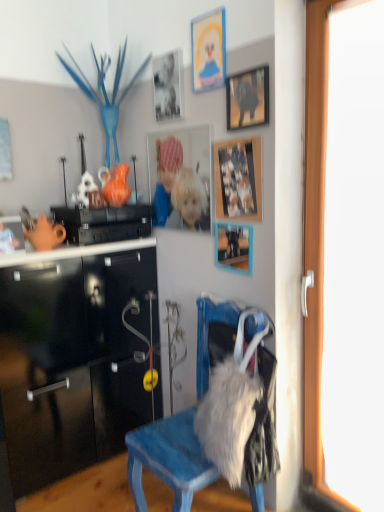
Question: Which direction should I rotate to face matte black picture frame at center, positioned as the 6th picture frame in top-to-bottom order, — up or down?

Choices:
 (A) up
 (B) down

Answer: (A)

Question: Does wooden photo frame at upper center, which is the 5th picture frame in top-to-bottom order, turn towards matte black picture frame at upper center, which is counted as the 4th picture frame, starting from the bottom?

Choices:
 (A) yes
 (B) no

Answer: (B)

Question: Is wooden photo frame at upper center, which is the 5th picture frame in top-to-bottom order, positioned with its back to matte black picture frame at upper center, acting as the third picture frame starting from the top?

Choices:
 (A) no
 (B) yes

Answer: (A)

Question: Considering the relative positions of wooden photo frame at upper center, which is the 5th picture frame in top-to-bottom order, and matte black picture frame at upper center, acting as the third picture frame starting from the top, in the image provided, is wooden photo frame at upper center, which is the 5th picture frame in top-to-bottom order, to the right of matte black picture frame at upper center, acting as the third picture frame starting from the top, from the viewer's perspective?

Choices:
 (A) yes
 (B) no

Answer: (B)

Question: Is wooden photo frame at upper center, the second picture frame when ordered from bottom to top, positioned behind matte black picture frame at upper center, acting as the third picture frame starting from the top?

Choices:
 (A) yes
 (B) no

Answer: (A)

Question: From a real-world perspective, is wooden photo frame at upper center, the second picture frame when ordered from bottom to top, physically above matte black picture frame at upper center, which is counted as the 4th picture frame, starting from the bottom?

Choices:
 (A) no
 (B) yes

Answer: (A)

Question: Is wooden photo frame at upper center, which is the 5th picture frame in top-to-bottom order, far from matte black picture frame at upper center, which is counted as the 4th picture frame, starting from the bottom?

Choices:
 (A) no
 (B) yes

Answer: (A)

Question: Is wooden photo frame at upper center, the second picture frame when ordered from bottom to top, with matte silver photo frame at upper center, the 5th picture frame when ordered from bottom to top?

Choices:
 (A) yes
 (B) no

Answer: (B)

Question: Are wooden photo frame at upper center, the second picture frame when ordered from bottom to top, and matte silver photo frame at upper center, the 5th picture frame when ordered from bottom to top, located far from each other?

Choices:
 (A) yes
 (B) no

Answer: (B)

Question: Does wooden photo frame at upper center, the second picture frame when ordered from bottom to top, appear on the right side of matte silver photo frame at upper center, the second picture frame from the top?

Choices:
 (A) no
 (B) yes

Answer: (B)

Question: Can you confirm if wooden photo frame at upper center, the second picture frame when ordered from bottom to top, is wider than matte silver photo frame at upper center, the 5th picture frame when ordered from bottom to top?

Choices:
 (A) yes
 (B) no

Answer: (B)

Question: Does wooden photo frame at upper center, which is the 5th picture frame in top-to-bottom order, come in front of matte silver photo frame at upper center, the 5th picture frame when ordered from bottom to top?

Choices:
 (A) yes
 (B) no

Answer: (A)

Question: Would you say matte silver photo frame at upper center, the 5th picture frame when ordered from bottom to top, is part of wooden photo frame at upper center, which is the 5th picture frame in top-to-bottom order,'s contents?

Choices:
 (A) no
 (B) yes

Answer: (A)

Question: From a real-world perspective, is black glossy cabinet at upper left physically above matte cardboard picture frame at upper center, arranged as the 1th picture frame when viewed from the top?

Choices:
 (A) yes
 (B) no

Answer: (B)